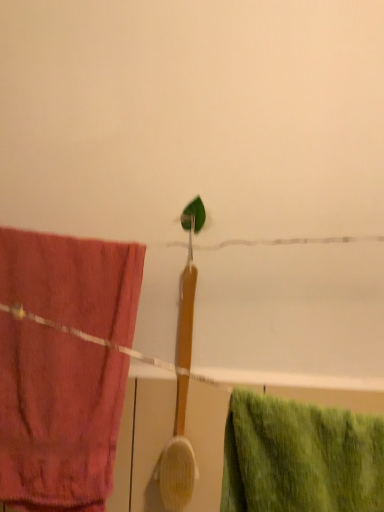
Locate an element on the screen. The height and width of the screenshot is (512, 384). red cotton towel at left is located at coordinates (57, 418).

What is the approximate width of red cotton towel at left?

red cotton towel at left is 2.50 inches in width.

Describe the element at coordinates (57, 418) in the screenshot. I see `red cotton towel at left` at that location.

This screenshot has height=512, width=384. Find the location of `red cotton towel at left`. red cotton towel at left is located at coordinates (57, 418).